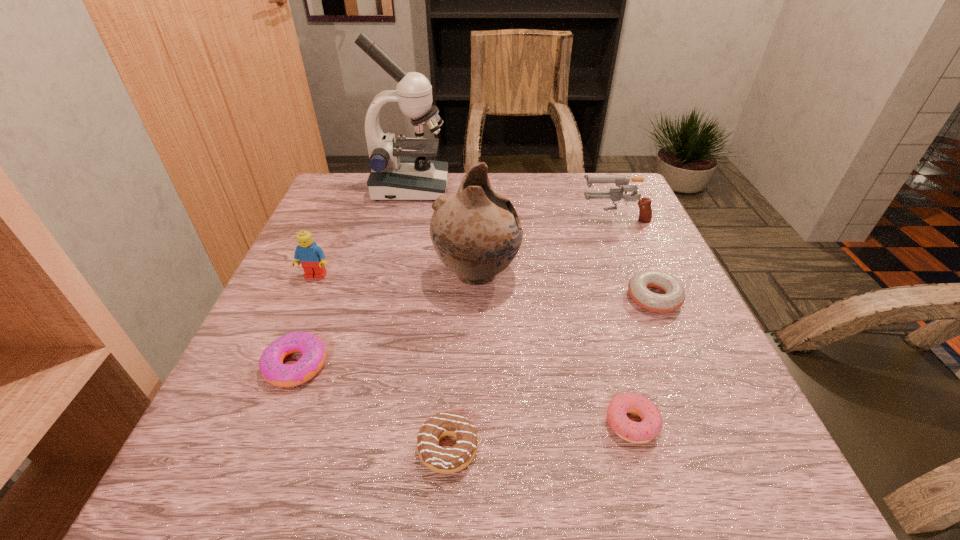
Locate an element on the screen. vacant region located on the left of the second doughnut from right to left is located at coordinates (540, 423).

I want to click on microscope situated at the far edge, so click(396, 175).

At what (x,y) coordinates should I click in order to perform the action: click on gun that is at the far edge. Please return your answer as a coordinate pair (x, y). Image resolution: width=960 pixels, height=540 pixels. Looking at the image, I should click on (645, 211).

I want to click on microscope situated at the left edge, so tap(396, 175).

At what (x,y) coordinates should I click in order to perform the action: click on Lego situated at the left edge. Please return your answer as a coordinate pair (x, y). This screenshot has height=540, width=960. Looking at the image, I should click on (311, 257).

I want to click on doughnut at the left edge, so click(x=273, y=370).

Locate an element on the screen. gun located in the right edge section of the desktop is located at coordinates (645, 211).

Where is `object at the far left corner`? object at the far left corner is located at coordinates (396, 175).

Find the location of a particular element. This screenshot has height=540, width=960. object located in the far right corner section of the desktop is located at coordinates (645, 211).

The height and width of the screenshot is (540, 960). In order to click on object that is positioned at the near right corner in this screenshot , I will do `click(641, 432)`.